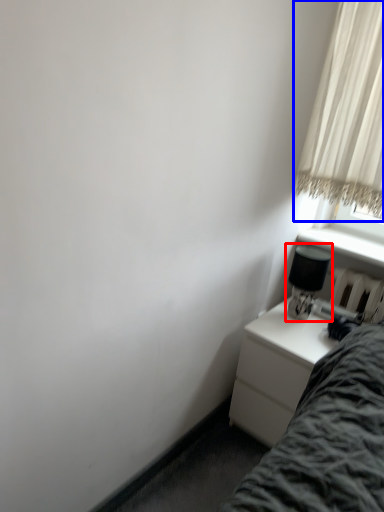
Question: Which point is closer to the camera, table lamp (highlighted by a red box) or curtain (highlighted by a blue box)?

Choices:
 (A) table lamp
 (B) curtain

Answer: (B)